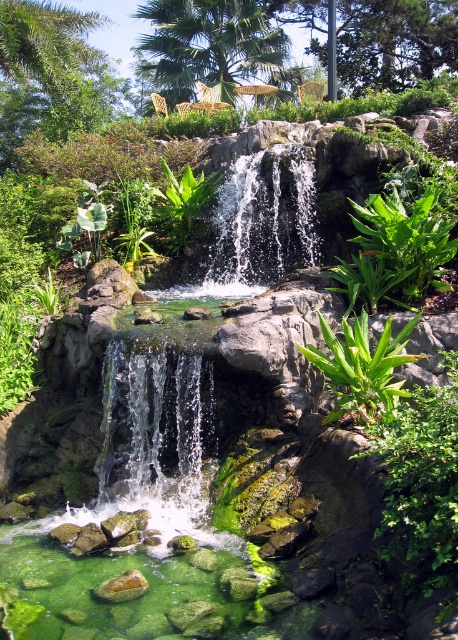
You are a landscape architect designing a garden. You have two options for the central feature of the garden. The first option is the clear water cascade at center, and the second option is the clear glass waterfall at center. Which of the two options has a narrower flow?

The clear water cascade at center is thinner than the clear glass waterfall at center, so the clear water cascade at center has a narrower flow.

Based on the photo, you are a landscape architect designing a new garden. You have two elements to place in the central area of the garden. The clear water cascade at center and the clear glass waterfall at center. According to the scene, which one is already on the left side of the other?

The clear water cascade at center is positioned on the left side of the clear glass waterfall at center.